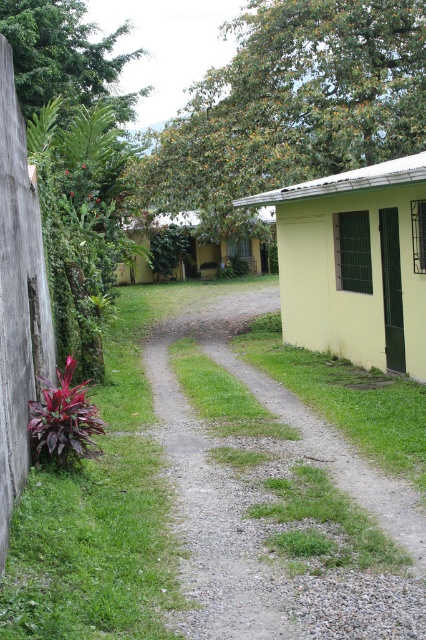
Is point (241, 172) behind point (94, 72)?

No, it is in front of (94, 72).

The image size is (426, 640). What are the coordinates of `green leafy tree at upper center` in the screenshot? It's located at (293, 106).

Is gravel path at center thinner than green matte hut at center?

Yes.

Is gravel path at center closer to the viewer compared to green matte hut at center?

Yes, gravel path at center is closer to the viewer.

Who is more forward, (x=345, y=618) or (x=196, y=259)?

Point (x=345, y=618) is more forward.

Locate an element on the screen. The height and width of the screenshot is (640, 426). gravel path at center is located at coordinates (270, 499).

Is gravel path at center below green leafy tree at upper left?

Yes, gravel path at center is below green leafy tree at upper left.

Who is positioned more to the left, gravel path at center or green leafy tree at upper left?

green leafy tree at upper left

Where is `gravel path at center`? This screenshot has width=426, height=640. gravel path at center is located at coordinates (270, 499).